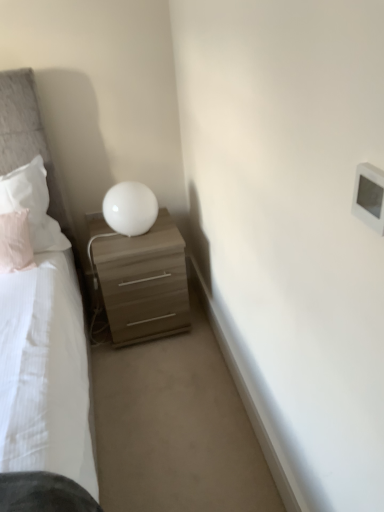
At what (x,y) coordinates should I click in order to perform the action: click on vacant area that is in front of white glossy sphere at upper right. Please return your answer as a coordinate pair (x, y). The image size is (384, 512). Looking at the image, I should click on (129, 249).